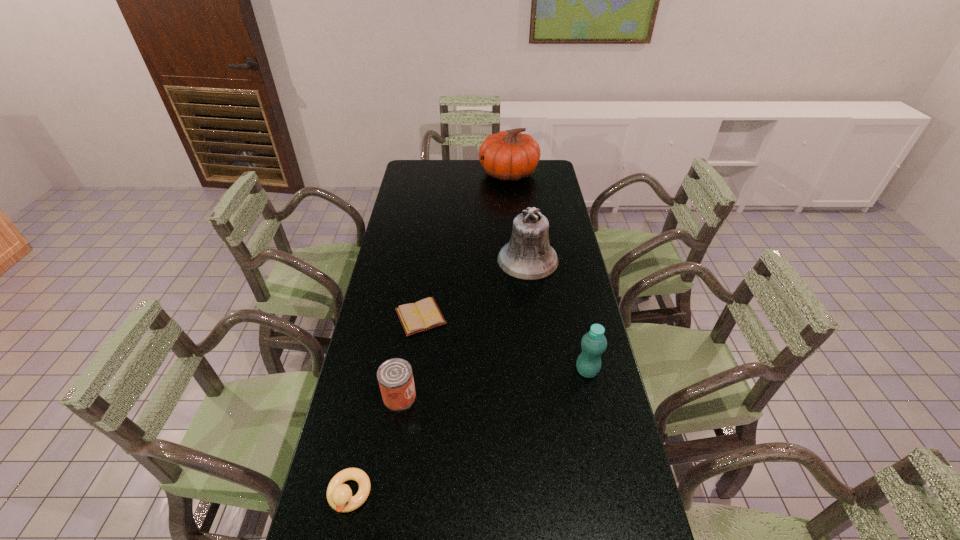
You are a GUI agent. You are given a task and a screenshot of the screen. Output one action in this format:
    pyautogui.click(x=<x>, y=<y>)
    Task: Click on the can located at the left edge
    
    Given the screenshot: What is the action you would take?
    pyautogui.click(x=395, y=377)

Locate an element on the screen. Image resolution: width=960 pixels, height=540 pixels. duckling that is positioned at the left edge is located at coordinates (339, 495).

Where is `diary that is at the left edge`? Image resolution: width=960 pixels, height=540 pixels. diary that is at the left edge is located at coordinates (423, 315).

Identify the location of pumpkin that is at the right edge. This screenshot has height=540, width=960. (509, 156).

Image resolution: width=960 pixels, height=540 pixels. What are the coordinates of `bell positioned at the right edge` in the screenshot? It's located at (528, 255).

Where is `water bottle present at the right edge`? water bottle present at the right edge is located at coordinates (593, 343).

Find the location of a particular element. This screenshot has height=540, width=960. object present at the far right corner is located at coordinates (509, 156).

This screenshot has height=540, width=960. What are the coordinates of `free location at the far edge of the desktop` in the screenshot? It's located at (484, 181).

In the image, there is a desktop. In order to click on free space at the left edge in this screenshot , I will do `click(412, 263)`.

In the image, there is a desktop. In order to click on free space at the right edge in this screenshot , I will do `click(583, 390)`.